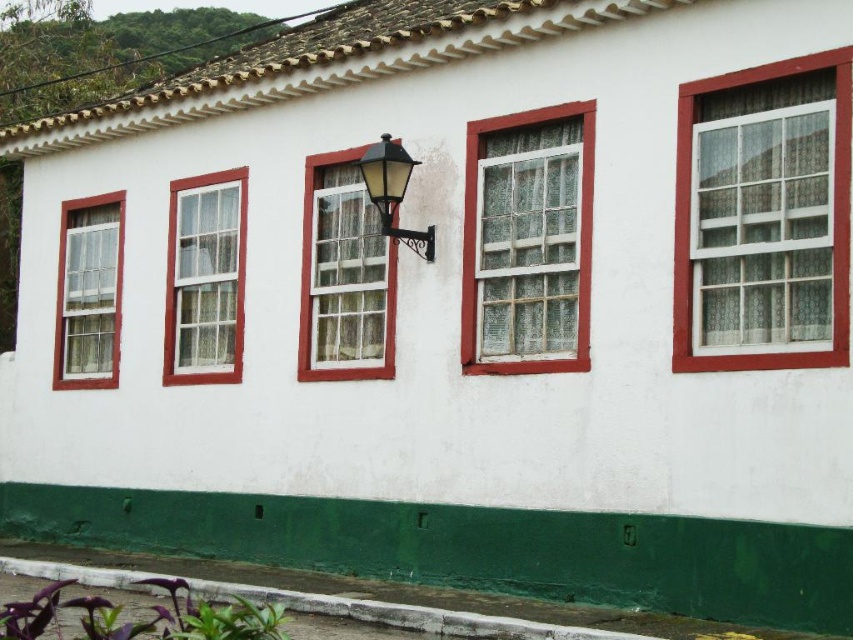
Question: Observing the image, what is the correct spatial positioning of white textured glass window at center in reference to white glass window at center left?

Choices:
 (A) below
 (B) above

Answer: (B)

Question: Does white glass window at center left appear under white glass window at left?

Choices:
 (A) yes
 (B) no

Answer: (B)

Question: Which object is the farthest from the white glass window at upper right?

Choices:
 (A) white glass window at left
 (B) white glass window at center left
 (C) matte yellow glass at center

Answer: (A)

Question: Which point is closer to the camera?

Choices:
 (A) (x=407, y=237)
 (B) (x=177, y=348)

Answer: (A)

Question: Which point is farther to the camera?

Choices:
 (A) (837, 61)
 (B) (84, 202)

Answer: (B)

Question: Is white glass window at center left to the right of matte yellow glass at center from the viewer's perspective?

Choices:
 (A) no
 (B) yes

Answer: (A)